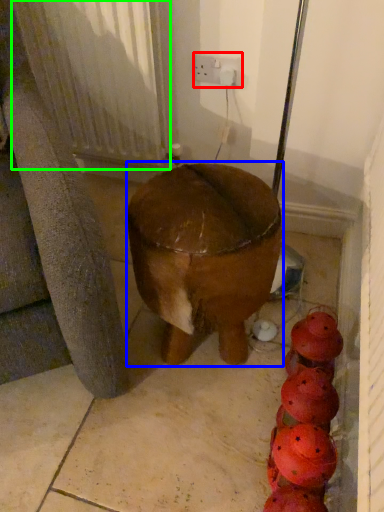
Question: Which object is the closest to the electric outlet (highlighted by a red box)? Choose among these: furniture (highlighted by a blue box) or radiator (highlighted by a green box).

Choices:
 (A) furniture
 (B) radiator

Answer: (B)